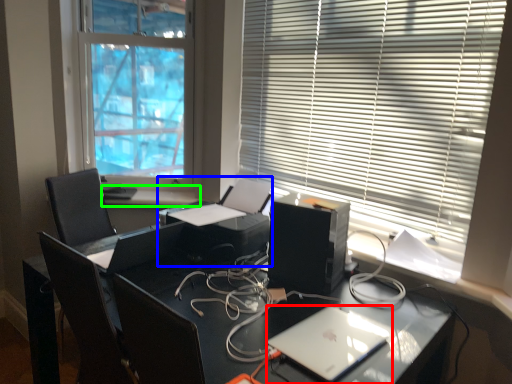
Question: Considering the real-world distances, which object is farthest from laptop (highlighted by a red box)? printer (highlighted by a blue box) or window sill (highlighted by a green box)?

Choices:
 (A) printer
 (B) window sill

Answer: (B)